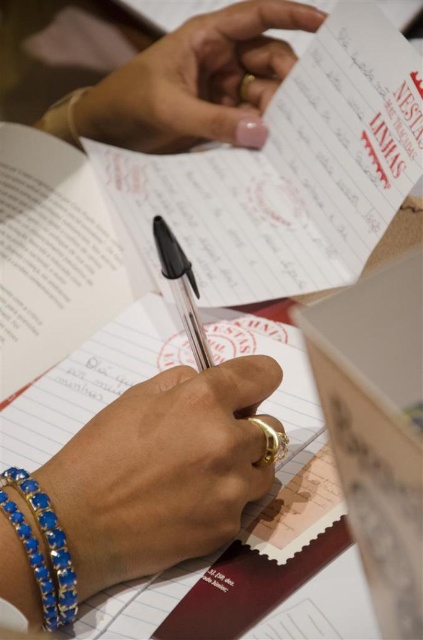
Who is taller, pink polished nails at upper center or blue crystal bracelet at lower left?

pink polished nails at upper center

Who is positioned more to the left, pink polished nails at upper center or blue crystal bracelet at lower left?

blue crystal bracelet at lower left is more to the left.

Where is `pink polished nails at upper center`? This screenshot has width=423, height=640. pink polished nails at upper center is located at coordinates (197, 81).

Can you confirm if gold ring at center is shorter than pink polished nails at upper center?

Indeed, gold ring at center has a lesser height compared to pink polished nails at upper center.

Does gold ring at center have a lesser width compared to pink polished nails at upper center?

Yes, gold ring at center is thinner than pink polished nails at upper center.

Measure the distance between gold ring at center and camera.

gold ring at center is 40.23 centimeters away from camera.

Image resolution: width=423 pixels, height=640 pixels. Find the location of `gold ring at center`. gold ring at center is located at coordinates (162, 472).

What do you see at coordinates (197, 81) in the screenshot? Image resolution: width=423 pixels, height=640 pixels. I see `pink polished nails at upper center` at bounding box center [197, 81].

Can you confirm if pink polished nails at upper center is taller than black plastic pen at center?

Correct, pink polished nails at upper center is much taller as black plastic pen at center.

At what (x,y) coordinates should I click in order to perform the action: click on pink polished nails at upper center. Please return your answer as a coordinate pair (x, y). The height and width of the screenshot is (640, 423). Looking at the image, I should click on (197, 81).